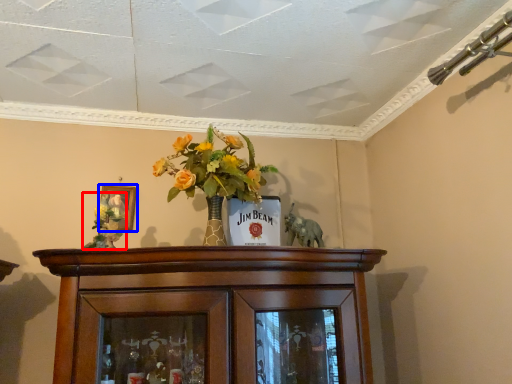
Question: Among these objects, which one is farthest to the camera, floral arrangement (highlighted by a red box) or picture frame (highlighted by a blue box)?

Choices:
 (A) floral arrangement
 (B) picture frame

Answer: (B)